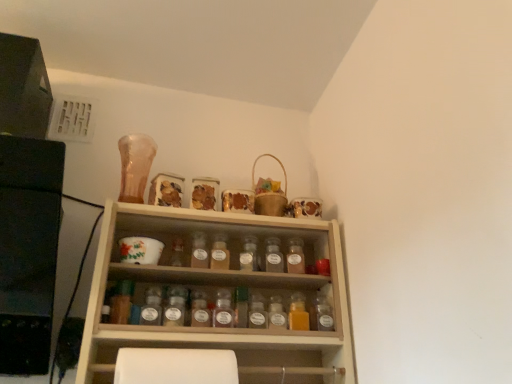
Question: Is translucent glass spice jar at center, marked as the second bottle in a left-to-right arrangement, at the back of translucent glass bottle at center, the 11th bottle when ordered from right to left?

Choices:
 (A) no
 (B) yes

Answer: (A)

Question: From a real-world perspective, is translucent glass bottle at center, the 1th bottle when ordered from left to right, on translucent glass spice jar at center, which ranks as the 10th bottle in right-to-left order?

Choices:
 (A) yes
 (B) no

Answer: (B)

Question: From a real-world perspective, is translucent glass bottle at center, the 11th bottle when ordered from right to left, beneath translucent glass spice jar at center, marked as the second bottle in a left-to-right arrangement?

Choices:
 (A) no
 (B) yes

Answer: (B)

Question: Is translucent glass bottle at center, the 11th bottle when ordered from right to left, closer to camera compared to translucent glass spice jar at center, which ranks as the 10th bottle in right-to-left order?

Choices:
 (A) yes
 (B) no

Answer: (A)

Question: Would you say translucent glass bottle at center, the 11th bottle when ordered from right to left, is outside translucent glass spice jar at center, which ranks as the 10th bottle in right-to-left order?

Choices:
 (A) yes
 (B) no

Answer: (A)

Question: Is translucent glass spice at center, the ninth bottle from the right, taller or shorter than translucent glass spice jar at center, which appears as the 5th bottle when viewed from the right?

Choices:
 (A) tall
 (B) short

Answer: (A)

Question: From a real-world perspective, is translucent glass spice at center, the ninth bottle from the right, above or below translucent glass spice jar at center, which appears as the 5th bottle when viewed from the right?

Choices:
 (A) above
 (B) below

Answer: (B)

Question: From the image's perspective, relative to translucent glass spice jar at center, which appears as the 5th bottle when viewed from the right, is translucent glass spice at center, the ninth bottle from the right, above or below?

Choices:
 (A) below
 (B) above

Answer: (A)

Question: Is point (202, 301) positioned closer to the camera than point (271, 266)?

Choices:
 (A) closer
 (B) farther

Answer: (A)

Question: Considering the positions of translucent glass spice at center, which appears as the sixth bottle when viewed from the left, and wooden spice rack at center in the image, is translucent glass spice at center, which appears as the sixth bottle when viewed from the left, bigger or smaller than wooden spice rack at center?

Choices:
 (A) small
 (B) big

Answer: (A)

Question: Would you say translucent glass spice at center, which appears as the sixth bottle when viewed from the left, is inside or outside wooden spice rack at center?

Choices:
 (A) inside
 (B) outside

Answer: (A)

Question: From a real-world perspective, relative to wooden spice rack at center, is translucent glass spice at center, the 6th bottle when ordered from right to left, vertically above or below?

Choices:
 (A) below
 (B) above

Answer: (B)

Question: In the image, is translucent glass spice at center, which appears as the sixth bottle when viewed from the left, on the left side or the right side of wooden spice rack at center?

Choices:
 (A) right
 (B) left

Answer: (A)

Question: In terms of width, does translucent glass spice at center, which appears as the sixth bottle when viewed from the left, look wider or thinner when compared to translucent glass spice jar at center, which ranks as the 10th bottle in right-to-left order?

Choices:
 (A) wide
 (B) thin

Answer: (A)

Question: Visually, is translucent glass spice at center, which appears as the sixth bottle when viewed from the left, positioned to the left or to the right of translucent glass spice jar at center, which ranks as the 10th bottle in right-to-left order?

Choices:
 (A) right
 (B) left

Answer: (A)